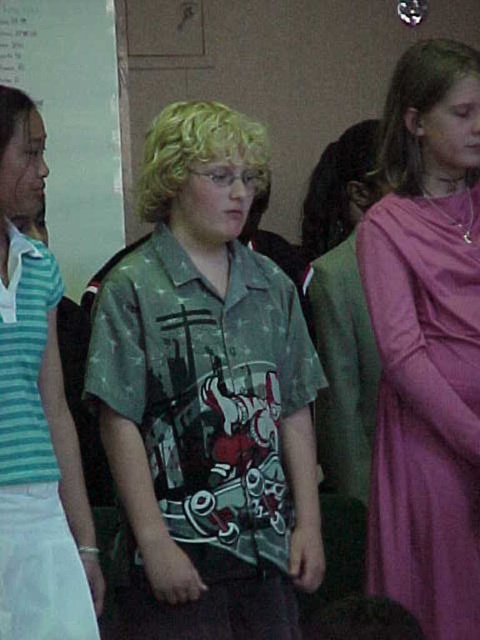
Question: In this image, where is blonde curly hair at upper right located relative to blonde hair at upper left?

Choices:
 (A) above
 (B) below

Answer: (A)

Question: Which object appears closest to the camera in this image?

Choices:
 (A) blonde hair at upper left
 (B) blonde curly hair at upper right
 (C) blonde curly hair at center

Answer: (A)

Question: Can you confirm if whiteboard at upper left is positioned to the right of dark brown hair at center?

Choices:
 (A) yes
 (B) no

Answer: (B)

Question: Which object is positioned farthest from the dark brown hair at center?

Choices:
 (A) whiteboard at upper left
 (B) printed cotton shirt at center

Answer: (A)

Question: Which point is farther to the camera?

Choices:
 (A) blonde curly hair at upper right
 (B) printed cotton shirt at center
 (C) blonde hair at upper left

Answer: (A)

Question: Where is printed cotton shirt at center located in relation to purple satin dress at right in the image?

Choices:
 (A) below
 (B) above

Answer: (B)